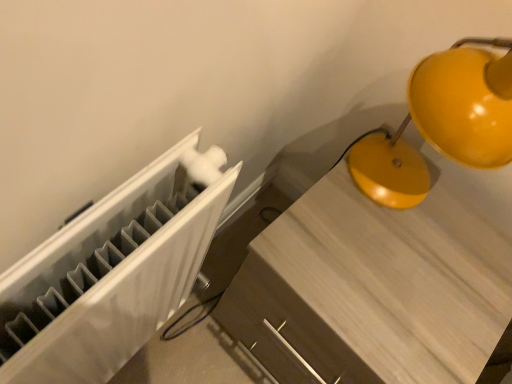
Locate an element on the screen. vacant space to the right of matte yellow lamp at upper right is located at coordinates (468, 249).